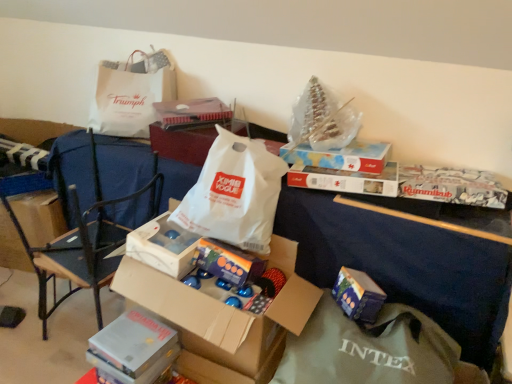
Question: From the image's perspective, is black metal chair at left located above white paper bag at upper left, placed as the first grocery bag when sorted from left to right?

Choices:
 (A) no
 (B) yes

Answer: (A)

Question: Is black metal chair at left behind white paper bag at upper left, the first grocery bag when ordered from top to bottom?

Choices:
 (A) yes
 (B) no

Answer: (B)

Question: Is black metal chair at left oriented towards white paper bag at upper left, which ranks as the first grocery bag in back-to-front order?

Choices:
 (A) yes
 (B) no

Answer: (B)

Question: Is black metal chair at left placed right next to white paper bag at upper left, which ranks as the 2th grocery bag in front-to-back order?

Choices:
 (A) no
 (B) yes

Answer: (A)

Question: From a real-world perspective, is black metal chair at left over white paper bag at upper left, placed as the first grocery bag when sorted from left to right?

Choices:
 (A) yes
 (B) no

Answer: (B)

Question: Would you say white paper bag at center is to the left or to the right of black metal chair at left in the picture?

Choices:
 (A) left
 (B) right

Answer: (B)

Question: Does point (287, 299) appear closer or farther from the camera than point (130, 198)?

Choices:
 (A) closer
 (B) farther

Answer: (A)

Question: Choose the correct answer: Is white paper bag at center inside black metal chair at left or outside it?

Choices:
 (A) inside
 (B) outside

Answer: (B)

Question: Is white paper bag at center bigger or smaller than black metal chair at left?

Choices:
 (A) big
 (B) small

Answer: (B)

Question: Considering the positions of white paper bag at upper left, the first grocery bag when ordered from top to bottom, and white paper bag at center in the image, is white paper bag at upper left, the first grocery bag when ordered from top to bottom, wider or thinner than white paper bag at center?

Choices:
 (A) wide
 (B) thin

Answer: (B)

Question: From their relative heights in the image, would you say white paper bag at upper left, which appears as the 2th grocery bag when viewed from the right, is taller or shorter than white paper bag at center?

Choices:
 (A) tall
 (B) short

Answer: (B)

Question: Does point (128, 127) appear closer or farther from the camera than point (287, 312)?

Choices:
 (A) farther
 (B) closer

Answer: (A)

Question: Is white paper bag at upper left, placed as the first grocery bag when sorted from left to right, in front of or behind white paper bag at center in the image?

Choices:
 (A) front
 (B) behind

Answer: (B)

Question: Is cardboard box at center bigger or smaller than blue glossy box at lower right, the first gift when ordered from right to left?

Choices:
 (A) small
 (B) big

Answer: (B)

Question: Considering the positions of cardboard box at center and blue glossy box at lower right, the first gift when ordered from right to left, in the image, is cardboard box at center wider or thinner than blue glossy box at lower right, the first gift when ordered from right to left,?

Choices:
 (A) thin
 (B) wide

Answer: (B)